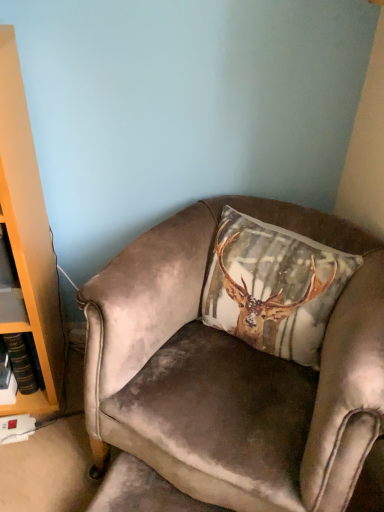
Question: In terms of width, does velvet beige pillow with deer print at center look wider or thinner when compared to velvet brown armchair at center?

Choices:
 (A) wide
 (B) thin

Answer: (B)

Question: Considering the positions of velvet beige pillow with deer print at center and velvet brown armchair at center in the image, is velvet beige pillow with deer print at center taller or shorter than velvet brown armchair at center?

Choices:
 (A) tall
 (B) short

Answer: (B)

Question: From a real-world perspective, relative to velvet brown armchair at center, is velvet beige pillow with deer print at center vertically above or below?

Choices:
 (A) below
 (B) above

Answer: (B)

Question: From their relative heights in the image, would you say velvet brown armchair at center is taller or shorter than velvet beige pillow with deer print at center?

Choices:
 (A) short
 (B) tall

Answer: (B)

Question: From a real-world perspective, is velvet brown armchair at center above or below velvet beige pillow with deer print at center?

Choices:
 (A) above
 (B) below

Answer: (B)

Question: From the image's perspective, is velvet brown armchair at center located above or below velvet beige pillow with deer print at center?

Choices:
 (A) below
 (B) above

Answer: (A)

Question: Would you say velvet brown armchair at center is to the left or to the right of velvet beige pillow with deer print at center in the picture?

Choices:
 (A) right
 (B) left

Answer: (B)